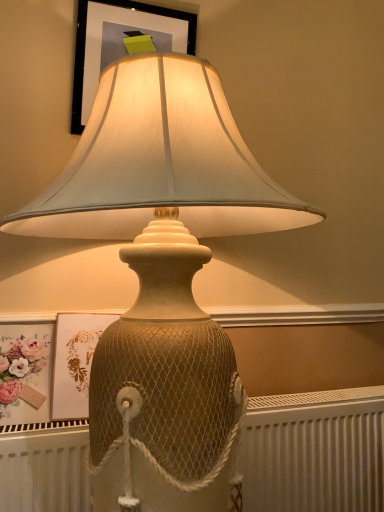
Question: Does matte floral print at lower left have a smaller size compared to matte black frame at upper center, placed as the 2th picture frame when sorted from bottom to top?

Choices:
 (A) no
 (B) yes

Answer: (B)

Question: Is matte floral print at lower left far from matte black frame at upper center, placed as the 2th picture frame when sorted from bottom to top?

Choices:
 (A) yes
 (B) no

Answer: (B)

Question: Does matte floral print at lower left come in front of matte black frame at upper center, placed as the 2th picture frame when sorted from bottom to top?

Choices:
 (A) yes
 (B) no

Answer: (A)

Question: Is matte floral print at lower left thinner than matte black frame at upper center, placed as the 2th picture frame when sorted from bottom to top?

Choices:
 (A) yes
 (B) no

Answer: (B)

Question: Is the position of matte floral print at lower left more distant than that of matte black frame at upper center, placed as the 2th picture frame when sorted from bottom to top?

Choices:
 (A) no
 (B) yes

Answer: (A)

Question: From the image's perspective, is white textured radiator at lower center positioned above or below matte floral print at lower left?

Choices:
 (A) below
 (B) above

Answer: (A)

Question: Is white textured radiator at lower center spatially inside matte floral print at lower left, or outside of it?

Choices:
 (A) inside
 (B) outside

Answer: (B)

Question: Does point (13, 473) appear closer or farther from the camera than point (18, 339)?

Choices:
 (A) farther
 (B) closer

Answer: (B)

Question: Considering the positions of white textured radiator at lower center and matte floral print at lower left in the image, is white textured radiator at lower center bigger or smaller than matte floral print at lower left?

Choices:
 (A) big
 (B) small

Answer: (A)

Question: Is matte floral print at lower left situated inside matte black frame at upper center, placed as the 2th picture frame when sorted from bottom to top, or outside?

Choices:
 (A) outside
 (B) inside

Answer: (A)

Question: Is matte floral print at lower left to the left or to the right of matte black frame at upper center, placed as the 2th picture frame when sorted from bottom to top, in the image?

Choices:
 (A) left
 (B) right

Answer: (A)

Question: Is matte floral print at lower left wider or thinner than matte black frame at upper center, which is the first picture frame from top to bottom?

Choices:
 (A) wide
 (B) thin

Answer: (A)

Question: Relative to matte black frame at upper center, which is the first picture frame from top to bottom, is matte floral print at lower left in front or behind?

Choices:
 (A) front
 (B) behind

Answer: (A)

Question: From a real-world perspective, is white textured radiator at lower center positioned above or below matte black frame at upper center, which is the first picture frame from top to bottom?

Choices:
 (A) below
 (B) above

Answer: (A)

Question: Considering the positions of white textured radiator at lower center and matte black frame at upper center, placed as the 2th picture frame when sorted from bottom to top, in the image, is white textured radiator at lower center wider or thinner than matte black frame at upper center, placed as the 2th picture frame when sorted from bottom to top,?

Choices:
 (A) wide
 (B) thin

Answer: (A)